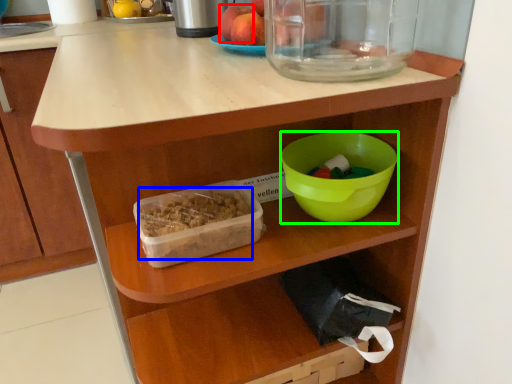
Question: Estimate the real-world distances between objects in this image. Which object is closer to apple (highlighted by a red box), food (highlighted by a blue box) or bowl (highlighted by a green box)?

Choices:
 (A) food
 (B) bowl

Answer: (B)